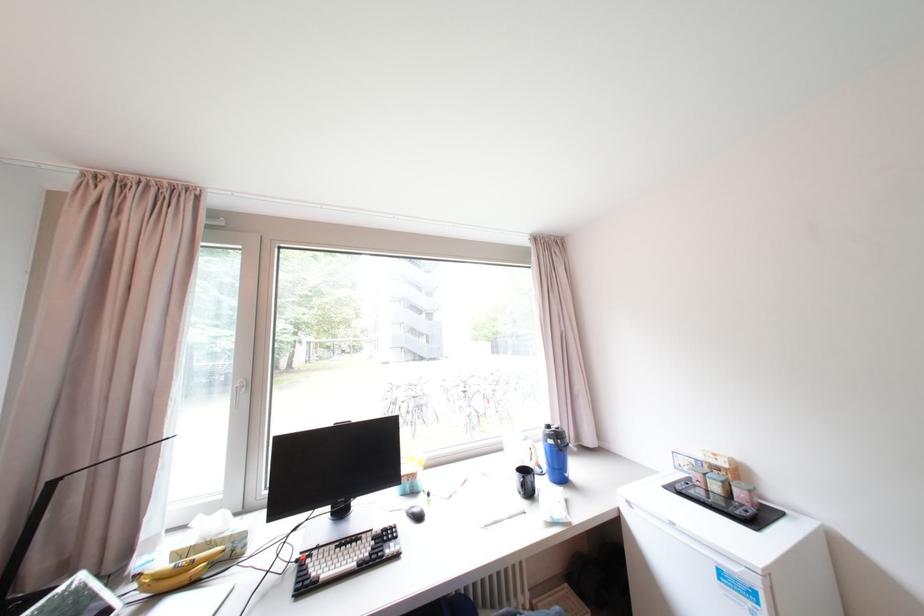
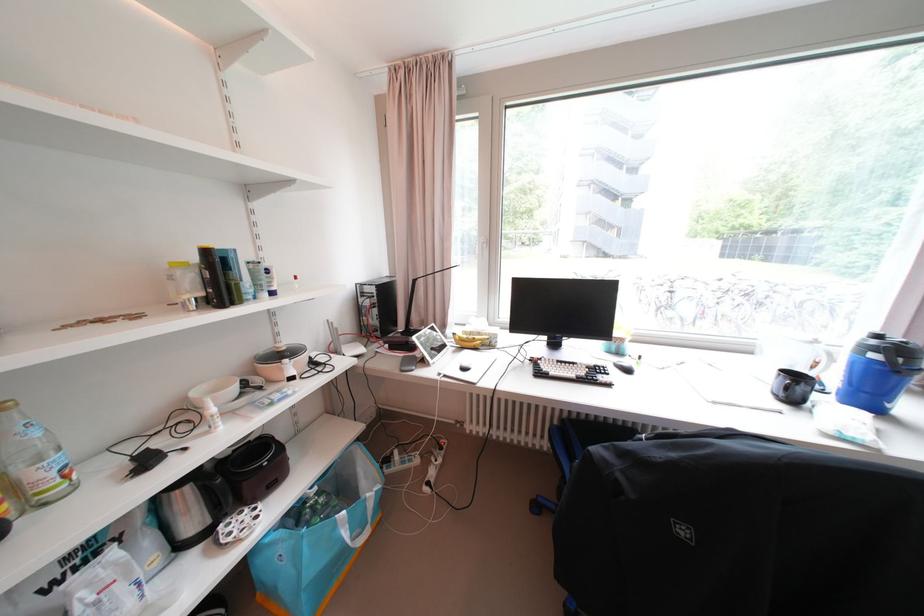
Based on the photo, the images are taken continuously from a first-person perspective. In which direction is your viewpoint rotating?

The rotation direction of the camera is left-down.